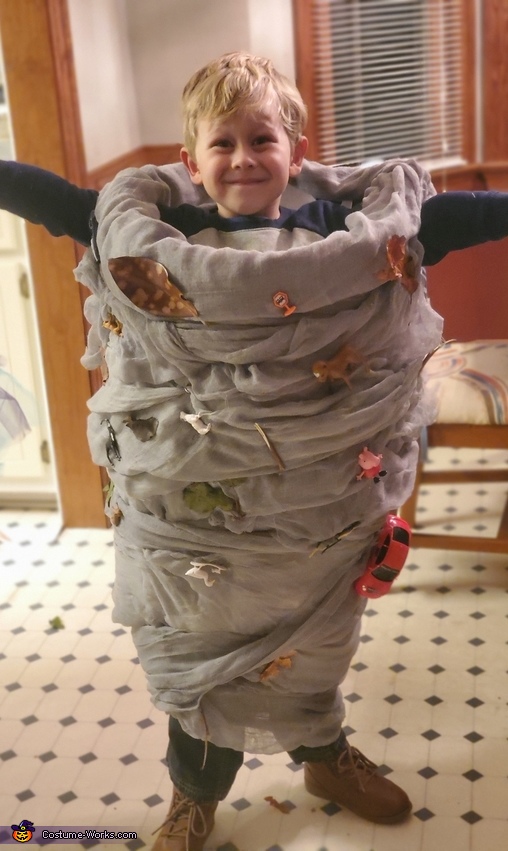
Locate an element on the screen. The image size is (508, 851). tiled floor is located at coordinates (419, 699).